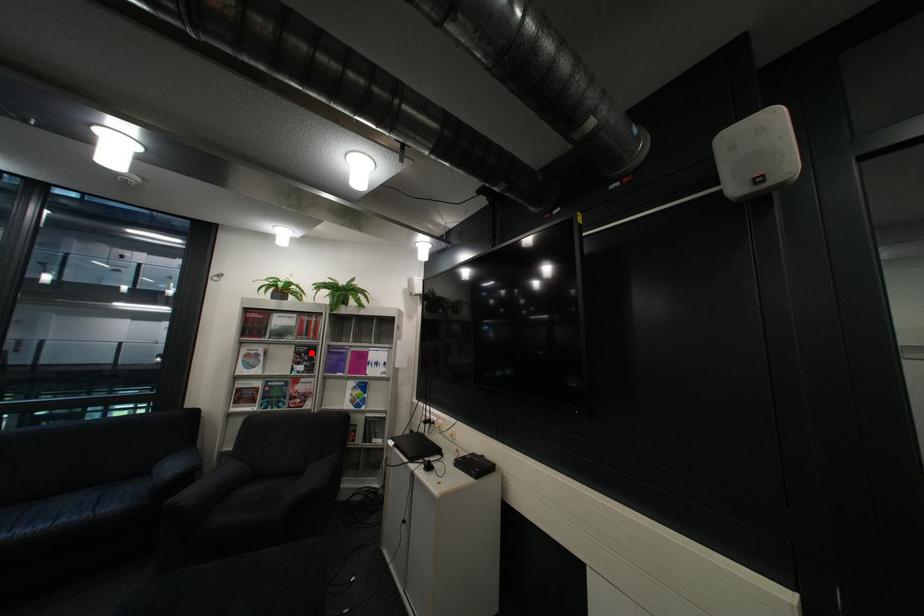
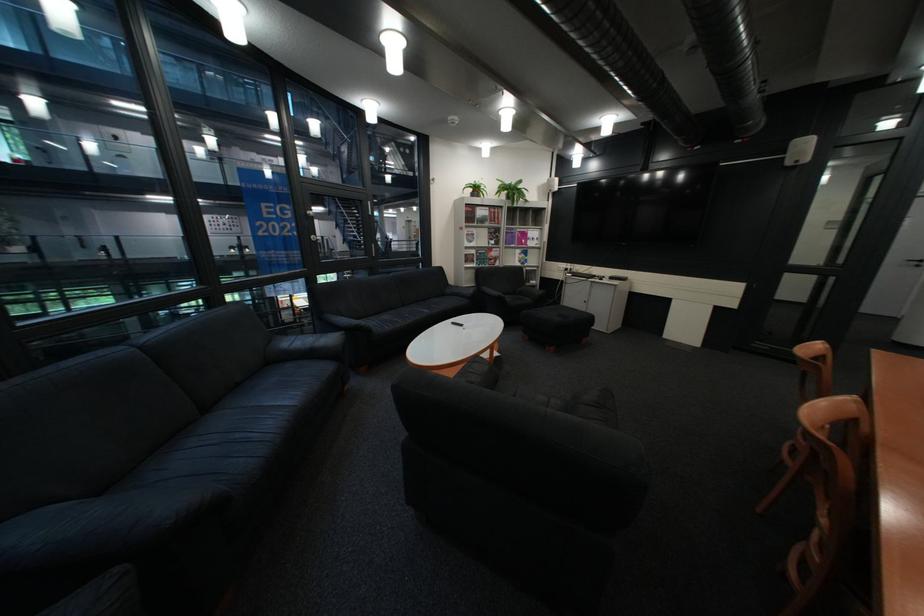
Question: I am providing you with two images of the same scene from different viewpoints. A red point is marked on the first image. Can you still see the location of the red point in image 2?

Choices:
 (A) Yes
 (B) No

Answer: (A)